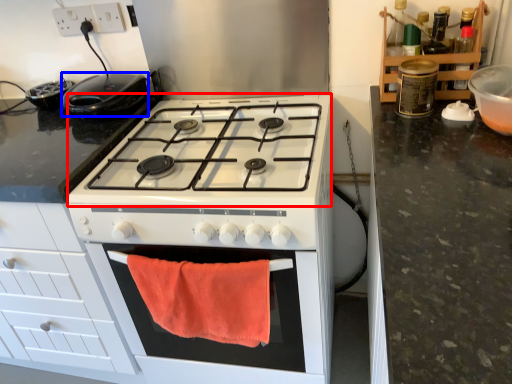
Question: Among these objects, which one is nearest to the camera, gas stove (highlighted by a red box) or kitchen appliance (highlighted by a blue box)?

Choices:
 (A) gas stove
 (B) kitchen appliance

Answer: (A)